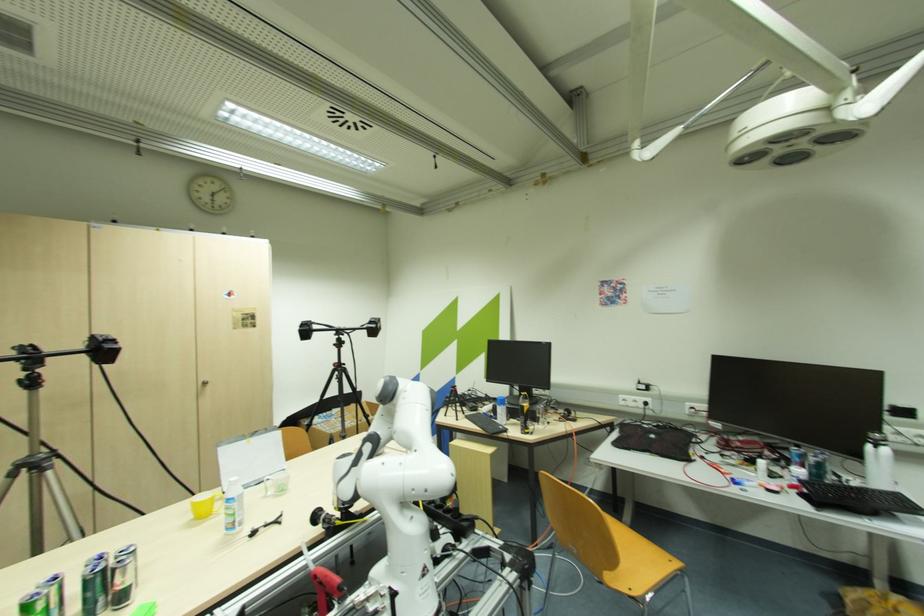
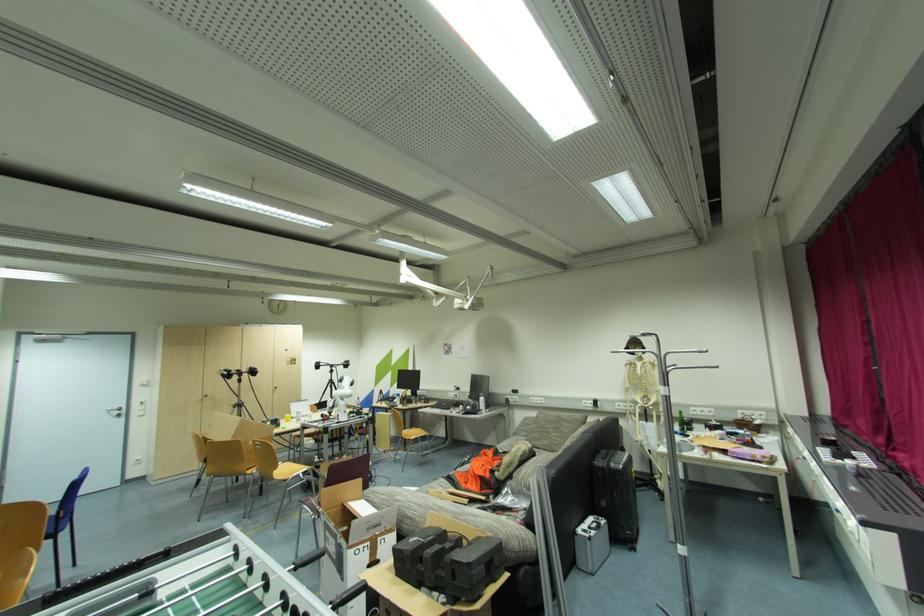
The point at (881,454) is marked in the first image. Where is the corresponding point in the second image?

(484, 400)